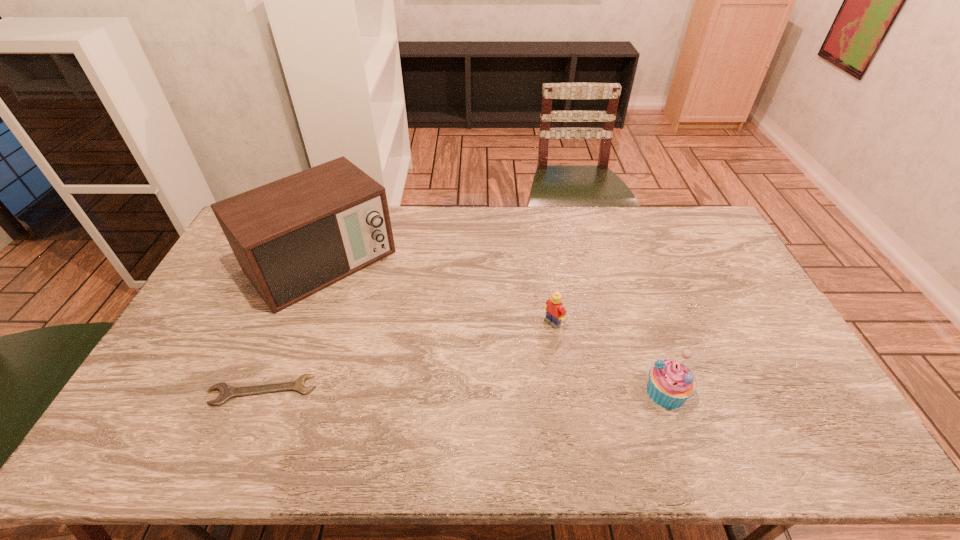
You are a GUI agent. You are given a task and a screenshot of the screen. Output one action in this format:
    pyautogui.click(x=<x>, y=<y>)
    Task: Click on the vacant space at the right edge of the desktop
    The width and height of the screenshot is (960, 540).
    Given the screenshot: What is the action you would take?
    pyautogui.click(x=749, y=304)

Locate an element on the screen. free space at the near left corner is located at coordinates (182, 413).

This screenshot has height=540, width=960. Identify the location of free space at the near right corner of the desktop. (789, 398).

Locate an element on the screen. The width and height of the screenshot is (960, 540). empty space between the muffin and the shortest object is located at coordinates (465, 391).

You are a GUI agent. You are given a task and a screenshot of the screen. Output one action in this format:
    pyautogui.click(x=<x>, y=<y>)
    Task: Click on the vacant area between the rightmost object and the radio receiver
    Image resolution: width=960 pixels, height=540 pixels.
    Given the screenshot: What is the action you would take?
    pyautogui.click(x=493, y=326)

Identify the location of blank region between the wrench and the second object from right to left. Image resolution: width=960 pixels, height=540 pixels. (407, 356).

What are the coordinates of `blank region between the radio receiver and the shortest object` in the screenshot? It's located at (292, 326).

The height and width of the screenshot is (540, 960). I want to click on free space between the muffin and the Lego, so click(610, 357).

Find the location of a particular element. free space between the second object from right to left and the wrench is located at coordinates (407, 356).

Locate an element on the screen. This screenshot has width=960, height=540. empty space that is in between the muffin and the shortest object is located at coordinates (465, 391).